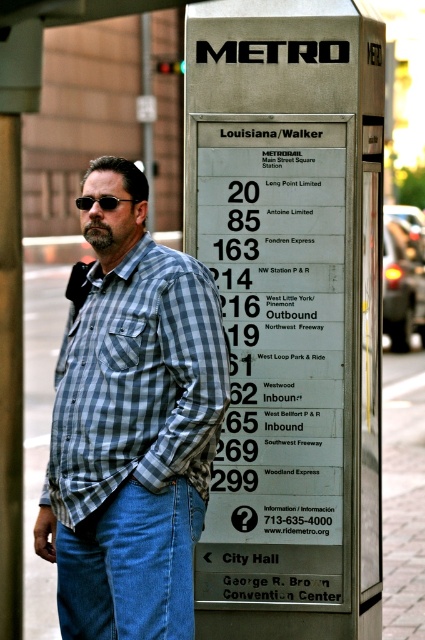
Which is behind, point (192, 627) or point (78, 198)?

The point (78, 198) is behind.

Does blue denim jeans at lower left appear over black matte sunglasses at upper left?

No.

Is point (187, 480) in front of point (74, 202)?

Yes, point (187, 480) is closer to viewer.

The image size is (425, 640). I want to click on blue denim jeans at lower left, so click(x=130, y=564).

Is metallic silver sign at center below black matte sunglasses at upper left?

Correct, metallic silver sign at center is located below black matte sunglasses at upper left.

Between metallic silver sign at center and black matte sunglasses at upper left, which one is positioned lower?

metallic silver sign at center is below.

Who is more distant from viewer, [303,598] or [85,196]?

Point [303,598]

The height and width of the screenshot is (640, 425). Identify the location of metallic silver sign at center. (291, 310).

Is checkered shirt at center bigger than blue denim jeans at lower left?

Correct, checkered shirt at center is larger in size than blue denim jeans at lower left.

In the scene shown: Does checkered shirt at center appear on the right side of blue denim jeans at lower left?

No, checkered shirt at center is not to the right of blue denim jeans at lower left.

Is point (127, 275) farther from camera compared to point (107, 556)?

Yes, it is.

Find the location of a particular element. Image resolution: width=425 pixels, height=640 pixels. checkered shirt at center is located at coordinates (132, 426).